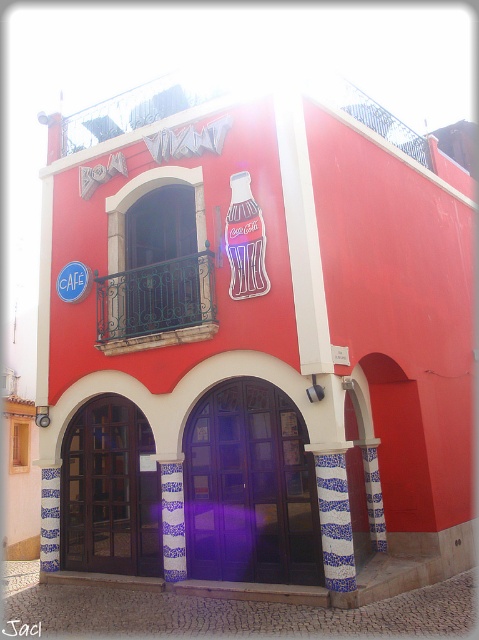
Question: Estimate the real-world distances between objects in this image. Which object is closer to the blue plastic cafe sign at upper left?

Choices:
 (A) purple wooden door at center
 (B) blue and white ceramic pillar at center

Answer: (B)

Question: Does black wrought iron at center have a larger size compared to blue plastic cafe sign at upper left?

Choices:
 (A) yes
 (B) no

Answer: (A)

Question: Based on their relative distances, which object is nearer to the black wrought iron at center?

Choices:
 (A) blue plastic cafe sign at upper left
 (B) blue and white ceramic pillar at center
 (C) purple wooden door at center

Answer: (A)

Question: Does brown wooden door at center come in front of blue plastic cafe sign at upper left?

Choices:
 (A) no
 (B) yes

Answer: (B)

Question: Among these points, which one is farthest from the camera?

Choices:
 (A) (263, 438)
 (B) (68, 262)
 (C) (345, 545)
 (D) (110, 333)

Answer: (B)

Question: Can you confirm if black wrought iron at center is bigger than blue and white ceramic pillar at center?

Choices:
 (A) no
 (B) yes

Answer: (B)